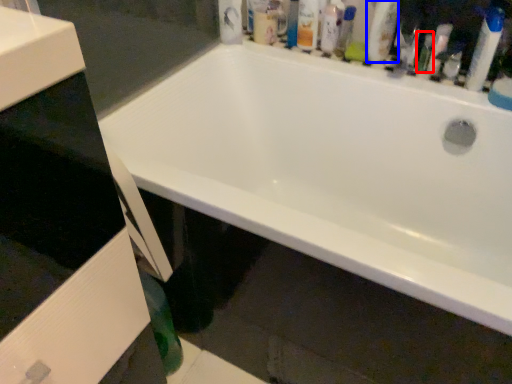
Question: Which point is further to the camera, toiletry (highlighted by a red box) or cleaning product (highlighted by a blue box)?

Choices:
 (A) toiletry
 (B) cleaning product

Answer: (A)